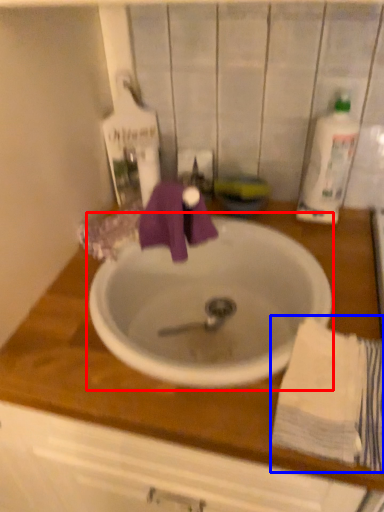
Question: Which point is closer to the camera, sink (highlighted by a red box) or bath towel (highlighted by a blue box)?

Choices:
 (A) sink
 (B) bath towel

Answer: (B)